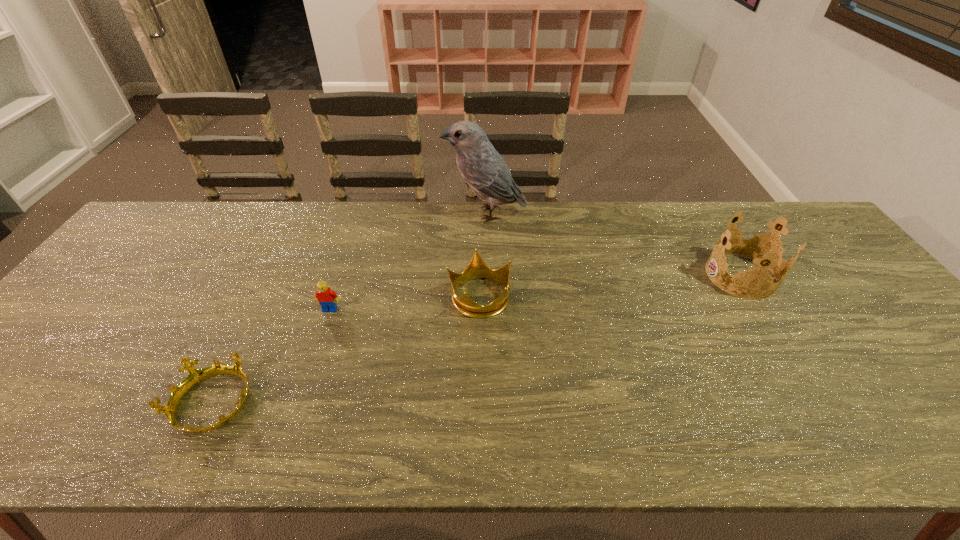
Identify the location of the farthest object. This screenshot has width=960, height=540. (485, 171).

At what (x,y) coordinates should I click in order to perform the action: click on parrot. Please return your answer as a coordinate pair (x, y). The width and height of the screenshot is (960, 540). Looking at the image, I should click on (485, 171).

Locate an element on the screen. the tallest crown is located at coordinates (756, 249).

You are a GUI agent. You are given a task and a screenshot of the screen. Output one action in this format:
    pyautogui.click(x=<x>, y=<y>)
    Task: Click on the rightmost crown
    This screenshot has width=960, height=540.
    Given the screenshot: What is the action you would take?
    pyautogui.click(x=756, y=249)

The height and width of the screenshot is (540, 960). Identify the location of Lego. (326, 297).

Locate an element on the screen. the second shortest crown is located at coordinates (476, 268).

The image size is (960, 540). What are the coordinates of `the nearest crown` in the screenshot? It's located at (195, 376).

In order to click on the shortest object in this screenshot , I will do [x=195, y=376].

The width and height of the screenshot is (960, 540). Find the location of `vacant space located on the front-facing side of the tallest object`. vacant space located on the front-facing side of the tallest object is located at coordinates (422, 213).

The width and height of the screenshot is (960, 540). In order to click on vacant space located on the front-facing side of the tallest object in this screenshot , I will do [x=396, y=213].